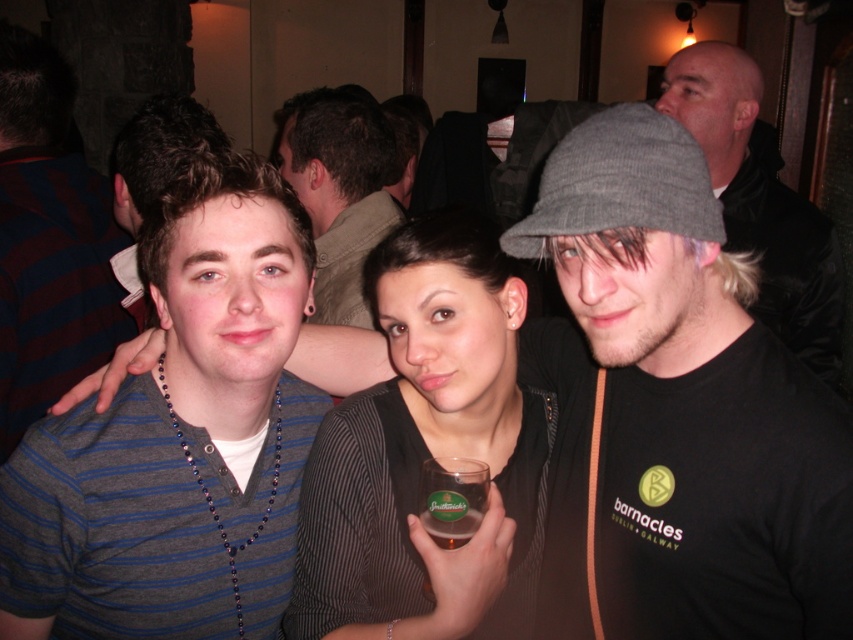
Can you confirm if black matte hat at upper right is thinner than matte brown shirt at center?

Yes.

Who is positioned more to the right, black matte hat at upper right or matte brown shirt at center?

Positioned to the right is black matte hat at upper right.

This screenshot has width=853, height=640. What do you see at coordinates (674, 410) in the screenshot? I see `black matte hat at upper right` at bounding box center [674, 410].

The height and width of the screenshot is (640, 853). Find the location of `black matte hat at upper right`. black matte hat at upper right is located at coordinates (674, 410).

Is striped cotton shirt at center positioned behind bald head at upper right?

No, it is not.

Describe the element at coordinates (177, 436) in the screenshot. This screenshot has width=853, height=640. I see `striped cotton shirt at center` at that location.

Is point (229, 180) behind point (807, 307)?

No, (229, 180) is in front of (807, 307).

Where is `striped cotton shirt at center`? The width and height of the screenshot is (853, 640). striped cotton shirt at center is located at coordinates (177, 436).

Which is more to the right, bald head at upper right or matte brown shirt at center?

bald head at upper right is more to the right.

Is the position of bald head at upper right more distant than that of matte brown shirt at center?

Yes, bald head at upper right is behind matte brown shirt at center.

Based on the photo, who is more distant from viewer, (717, 93) or (289, 102)?

Point (289, 102)

Image resolution: width=853 pixels, height=640 pixels. What are the coordinates of `bald head at upper right` in the screenshot? It's located at (x=761, y=202).